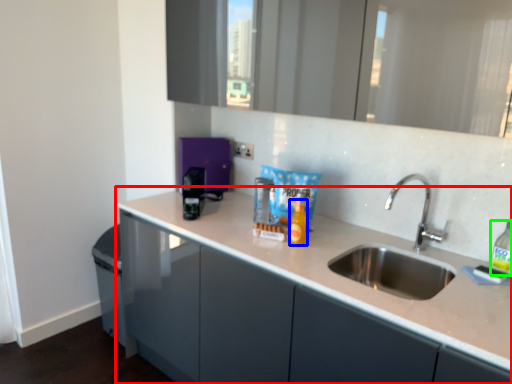
Question: Which is farther away from countertop (highlighted by a red box)? bottle (highlighted by a blue box) or bottle (highlighted by a green box)?

Choices:
 (A) bottle
 (B) bottle

Answer: (B)